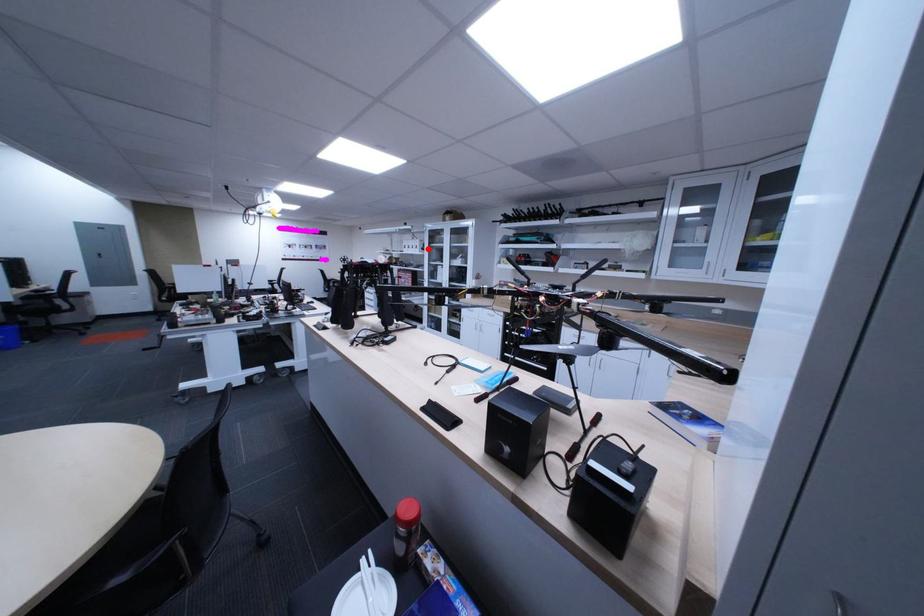
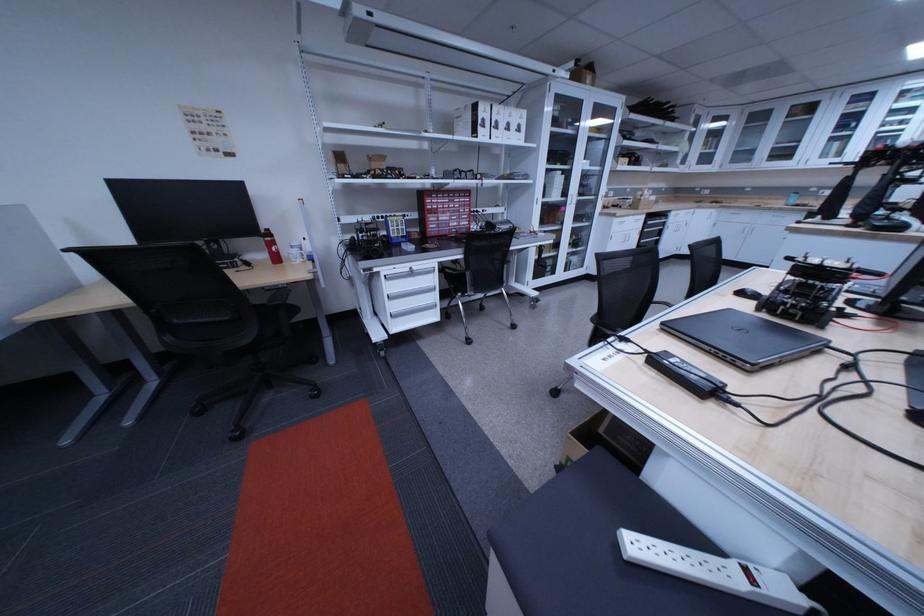
The point at the highlighted location is marked in the first image. Where is the corresponding point in the second image?

(524, 130)